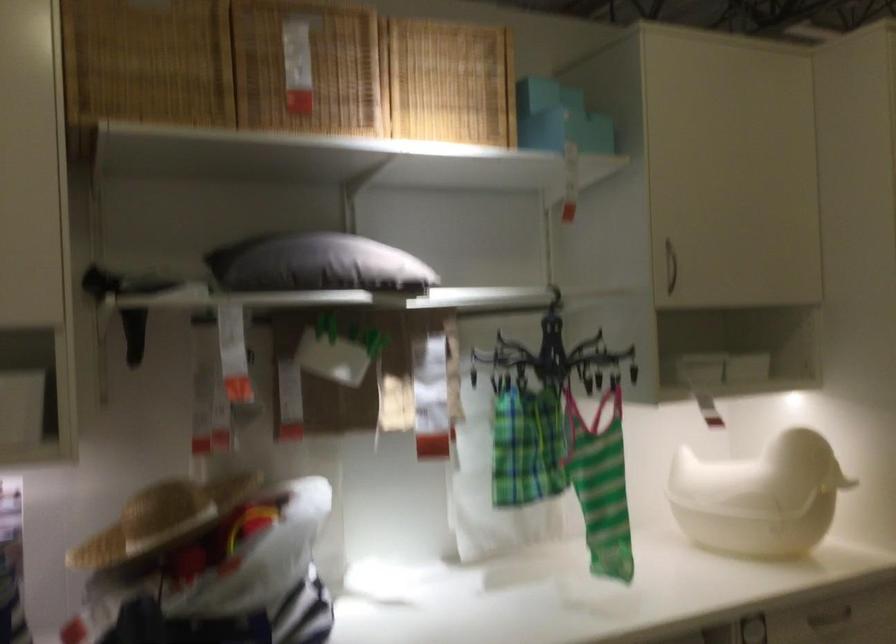
Describe the element at coordinates (669, 266) in the screenshot. I see `the white cabinet handle` at that location.